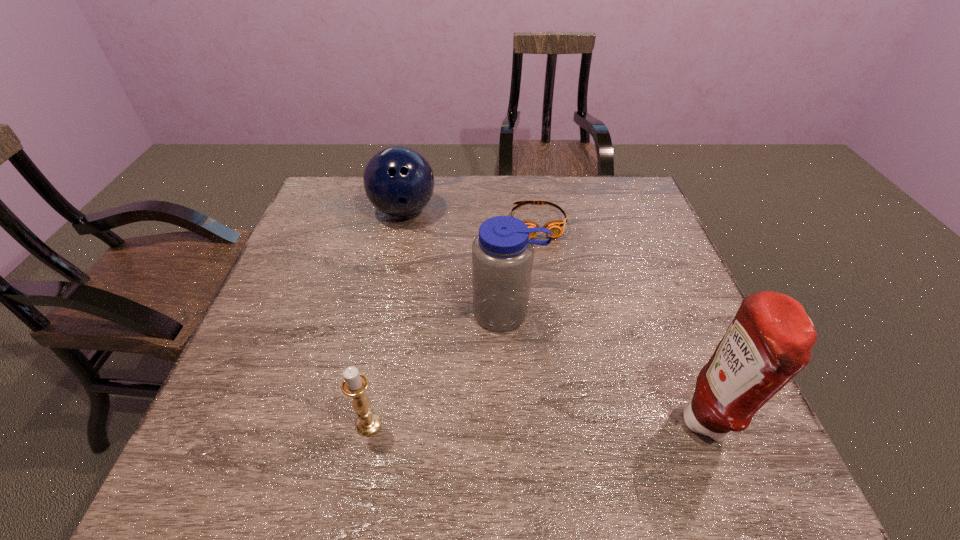
You are a GUI agent. You are given a task and a screenshot of the screen. Output one action in this format:
    pyautogui.click(x=<x>, y=<y>)
    Task: Click on the candle holder
    
    Given the screenshot: What is the action you would take?
    pyautogui.click(x=354, y=384)

Where is `condiment`? condiment is located at coordinates (769, 341).

Find the location of a particular element. This screenshot has width=960, height=540. the tallest object is located at coordinates (769, 341).

The width and height of the screenshot is (960, 540). I want to click on water bottle, so click(x=502, y=254).

Locate an element on the screen. This screenshot has width=960, height=540. the second tallest object is located at coordinates (502, 254).

Identify the location of bowling ball. This screenshot has height=540, width=960. (398, 180).

This screenshot has height=540, width=960. Identify the location of the shortest object. (556, 227).

The image size is (960, 540). Identify the location of free space located on the right of the candle holder. (460, 424).

You are a GUI agent. You are given a task and a screenshot of the screen. Output one action in this format:
    pyautogui.click(x=<x>, y=<y>)
    Task: Click on the free space located on the back of the tallest object
    The image size is (960, 540).
    Given the screenshot: What is the action you would take?
    pyautogui.click(x=670, y=327)

Where is `free point located with a carrying loop on the side of the water bottle`? The image size is (960, 540). free point located with a carrying loop on the side of the water bottle is located at coordinates (499, 352).